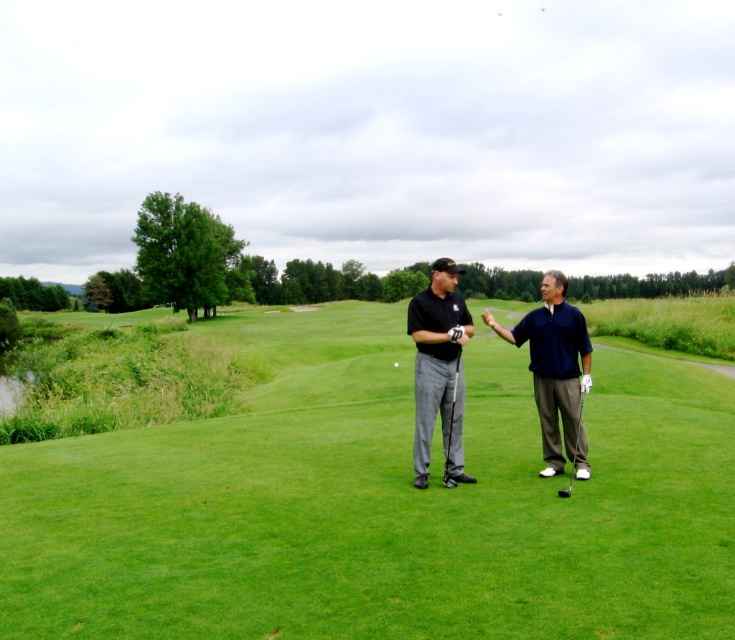
How distant is green grass at center from matte black golf clubs at center?

49.03 feet

Which is below, green grass at center or matte black golf clubs at center?

Positioned lower is green grass at center.

Which is behind, point (358, 506) or point (559, 452)?

Positioned behind is point (559, 452).

This screenshot has width=735, height=640. What are the coordinates of `green grass at center` in the screenshot? It's located at point(379,504).

Which is more to the left, matte black shirt at center or white matte golf ball at center?

white matte golf ball at center is more to the left.

This screenshot has width=735, height=640. Identify the location of matte black shirt at center. (437, 369).

Is point (429, 301) in front of point (394, 365)?

Yes, point (429, 301) is in front of point (394, 365).

You are a GUI agent. You are given a task and a screenshot of the screen. Output one action in this format:
    pyautogui.click(x=<x>, y=<y>)
    Task: Click on the matte black shirt at center
    This screenshot has height=640, width=735.
    Given the screenshot: What is the action you would take?
    pyautogui.click(x=437, y=369)

The image size is (735, 640). Describe the element at coordinates (573, 449) in the screenshot. I see `metallic silver golf club at center` at that location.

Based on the photo, does metallic silver golf club at center have a lesser width compared to white matte golf ball at center?

No, metallic silver golf club at center is not thinner than white matte golf ball at center.

The height and width of the screenshot is (640, 735). Describe the element at coordinates (573, 449) in the screenshot. I see `metallic silver golf club at center` at that location.

This screenshot has width=735, height=640. Find the location of `metallic silver golf club at center`. metallic silver golf club at center is located at coordinates (573, 449).